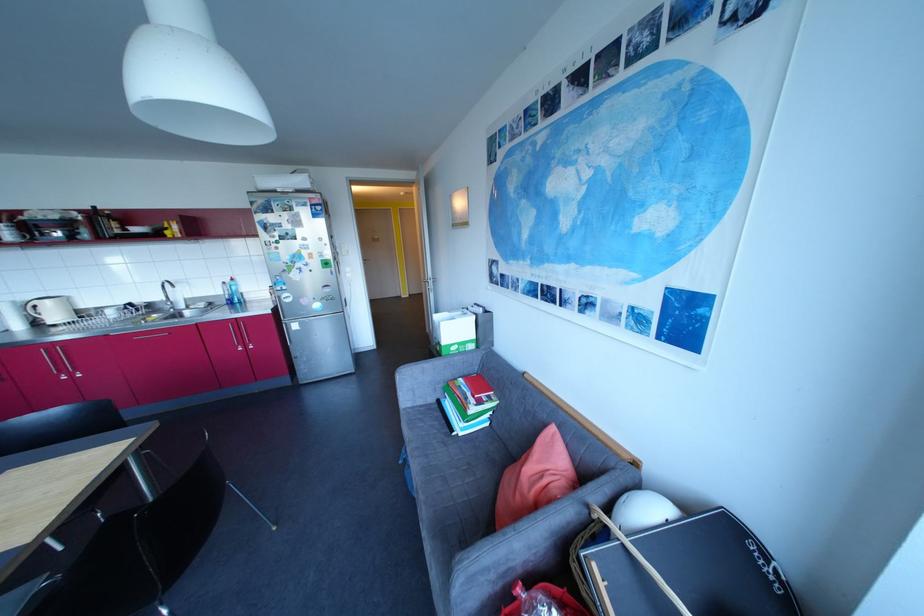
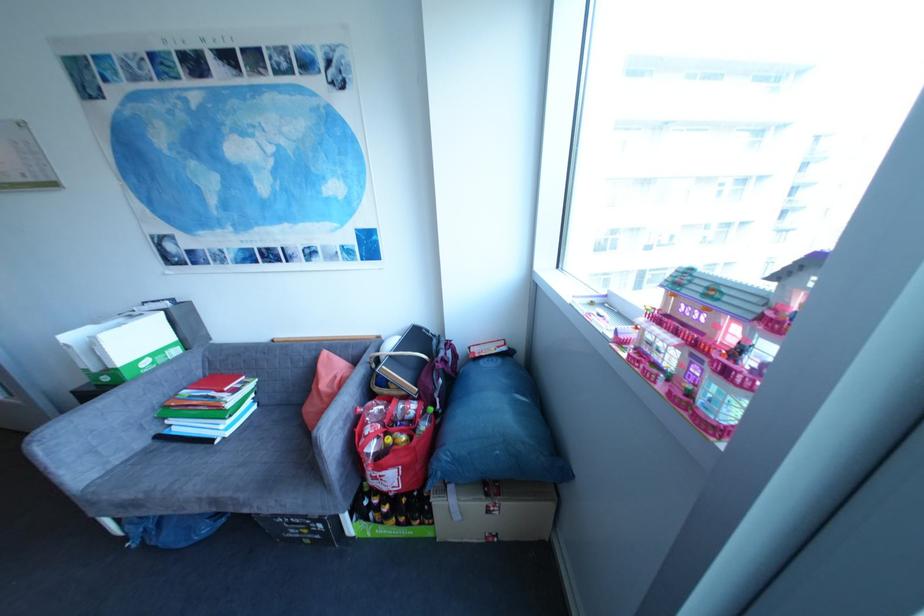
Question: The camera is either moving clockwise (left) or counter-clockwise (right) around the object. The first image is from the beginning of the video and the second image is from the end. Is the camera moving left or right when shooting the video?

Choices:
 (A) Left
 (B) Right

Answer: (A)